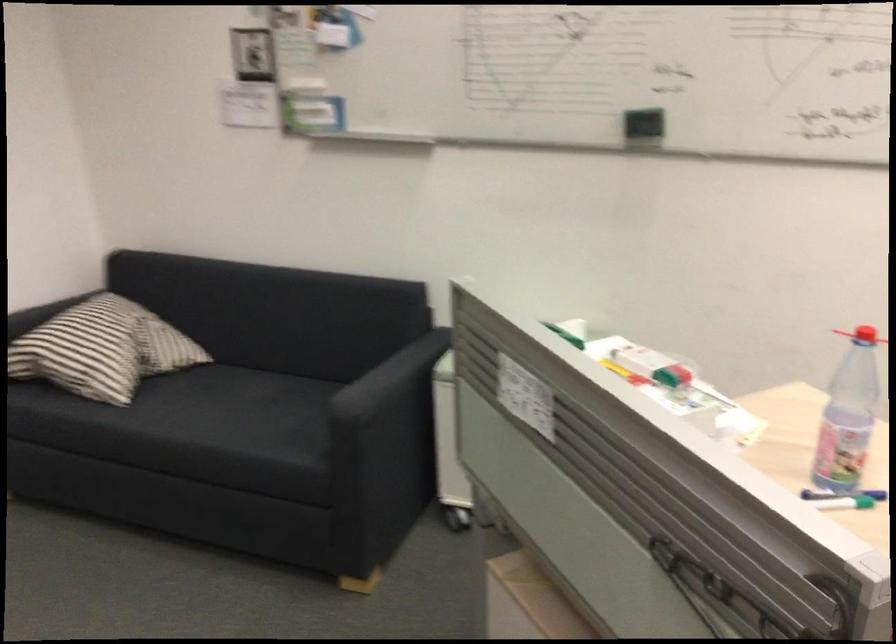
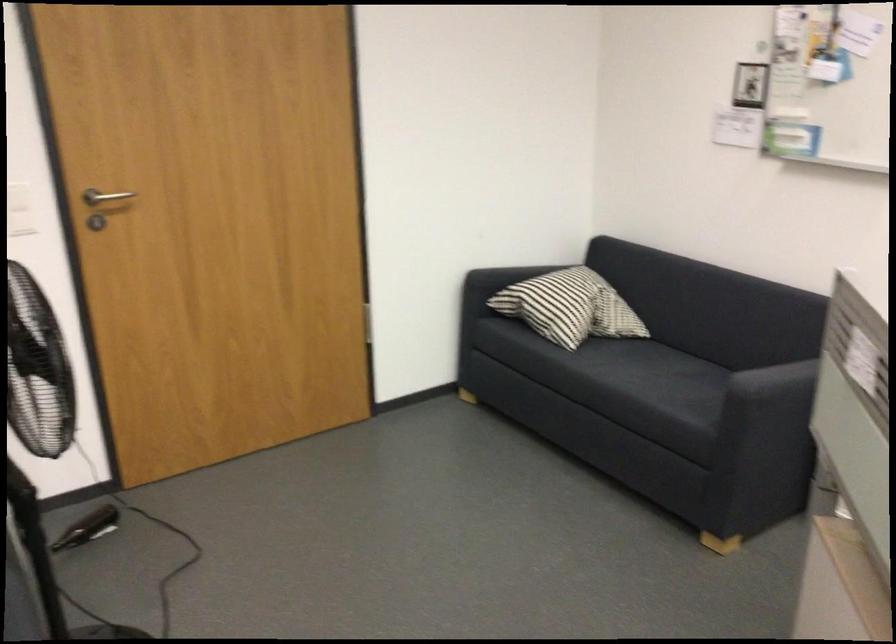
Locate, in the second image, the point that corresponds to pixel 248 399 in the first image.

(668, 370)